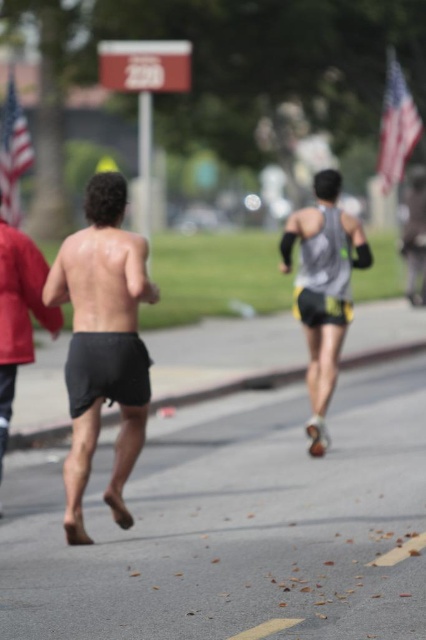
Measure the distance between gray matte running suit at center and camera.

gray matte running suit at center and camera are 32.35 feet apart from each other.

Where is `gray matte running suit at center`? This screenshot has width=426, height=640. gray matte running suit at center is located at coordinates (324, 289).

Locate an element on the screen. The image size is (426, 640). black matte shorts at center is located at coordinates (103, 342).

Can you confirm if black matte shorts at center is positioned to the right of black matte shorts at left?

Indeed, black matte shorts at center is positioned on the right side of black matte shorts at left.

Describe the element at coordinates (103, 342) in the screenshot. I see `black matte shorts at center` at that location.

Locate an element on the screen. The image size is (426, 640). black matte shorts at center is located at coordinates (103, 342).

Is point (6, 330) less distant than point (100, 355)?

That is False.

Between black matte shorts at left and black cotton shorts at center, which one appears on the left side from the viewer's perspective?

black matte shorts at left is more to the left.

Who is more forward, (5, 282) or (112, 374)?

A: Point (112, 374) is more forward.

Identify the location of black matte shorts at left. (19, 314).